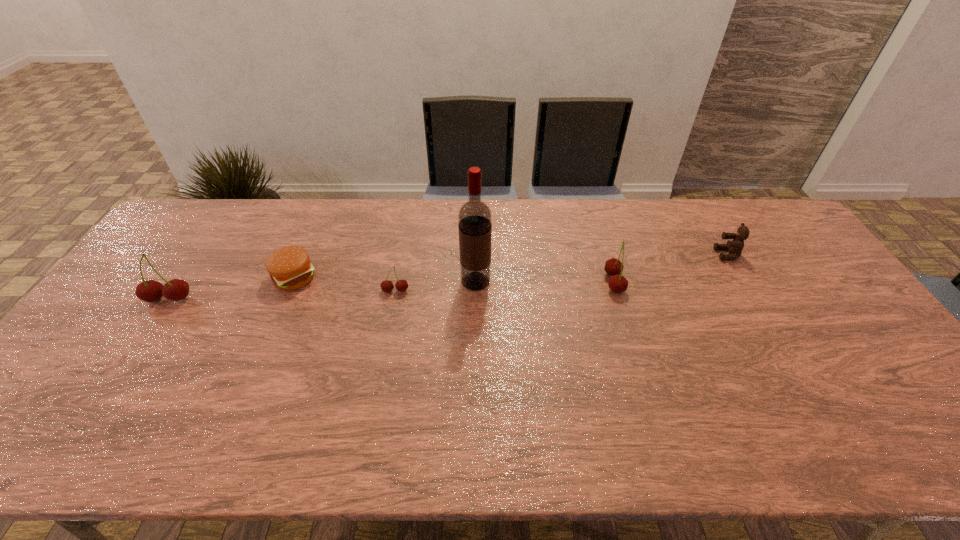
Where is `free space for a new cherry on the right`? The width and height of the screenshot is (960, 540). free space for a new cherry on the right is located at coordinates (826, 275).